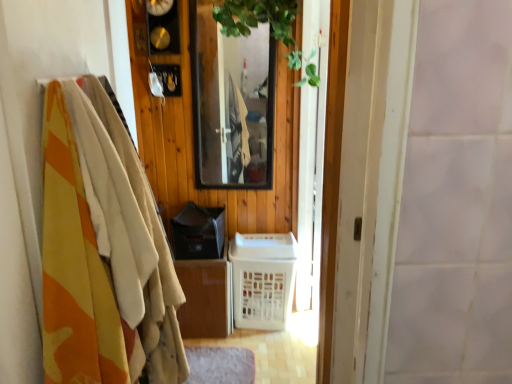
Question: From a real-world perspective, is camouflage fabric blanket at left physically above green leafy plant at upper center?

Choices:
 (A) yes
 (B) no

Answer: (B)

Question: Does camouflage fabric blanket at left contain green leafy plant at upper center?

Choices:
 (A) yes
 (B) no

Answer: (B)

Question: Is camouflage fabric blanket at left oriented away from green leafy plant at upper center?

Choices:
 (A) no
 (B) yes

Answer: (A)

Question: Can you see camouflage fabric blanket at left touching green leafy plant at upper center?

Choices:
 (A) no
 (B) yes

Answer: (A)

Question: From a real-world perspective, is camouflage fabric blanket at left located beneath green leafy plant at upper center?

Choices:
 (A) no
 (B) yes

Answer: (B)

Question: Considering their positions, is green leafy plant at upper center located in front of or behind camouflage fabric blanket at left?

Choices:
 (A) front
 (B) behind

Answer: (B)

Question: Is point (261, 3) positioned closer to the camera than point (49, 264)?

Choices:
 (A) closer
 (B) farther

Answer: (B)

Question: From a real-world perspective, is green leafy plant at upper center positioned above or below camouflage fabric blanket at left?

Choices:
 (A) below
 (B) above

Answer: (B)

Question: Looking at their shapes, would you say green leafy plant at upper center is wider or thinner than camouflage fabric blanket at left?

Choices:
 (A) thin
 (B) wide

Answer: (B)

Question: Considering the relative positions of camouflage fabric blanket at left and white plastic basket at center in the image provided, is camouflage fabric blanket at left to the left or to the right of white plastic basket at center?

Choices:
 (A) left
 (B) right

Answer: (A)

Question: Is camouflage fabric blanket at left wider or thinner than white plastic basket at center?

Choices:
 (A) wide
 (B) thin

Answer: (B)

Question: Is camouflage fabric blanket at left situated inside white plastic basket at center or outside?

Choices:
 (A) outside
 (B) inside

Answer: (A)

Question: From their relative heights in the image, would you say camouflage fabric blanket at left is taller or shorter than white plastic basket at center?

Choices:
 (A) short
 (B) tall

Answer: (B)

Question: Is white plastic basket at center to the left or to the right of clear glass mirror at center in the image?

Choices:
 (A) left
 (B) right

Answer: (B)

Question: From the image's perspective, is white plastic basket at center located above or below clear glass mirror at center?

Choices:
 (A) above
 (B) below

Answer: (B)